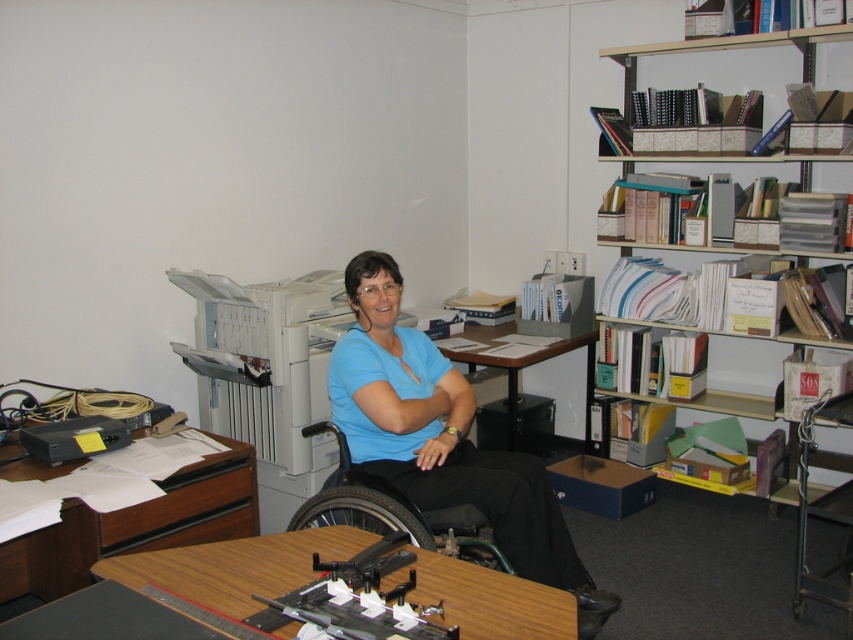
You are standing in the office and need to reach both the point at coordinates (421, 516) and the point at coordinates (469, 333). Which point is closer to you?

The point at coordinates (421, 516) is closer to you than the point at coordinates (469, 333).

You are a caregiver who needs to move a medical supply cart that is 4 feet wide into the space between the black plastic wheelchair at center and the wooden desk at center. Can the cart fit through the space?

The black plastic wheelchair at center and wooden desk at center are 4.39 feet apart from each other. Since the medical supply cart is 4 feet wide, it can fit through the space as the distance between them is greater than the cart width.